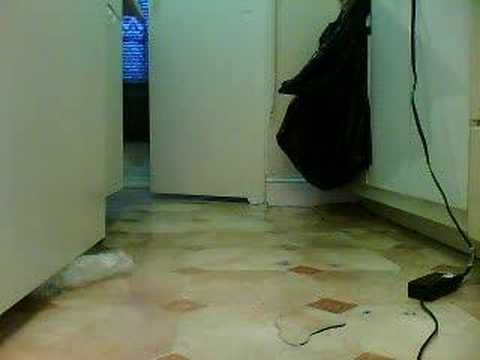
Where is `floor where there is a patch of something on it`? The image size is (480, 360). floor where there is a patch of something on it is located at coordinates (301, 314).